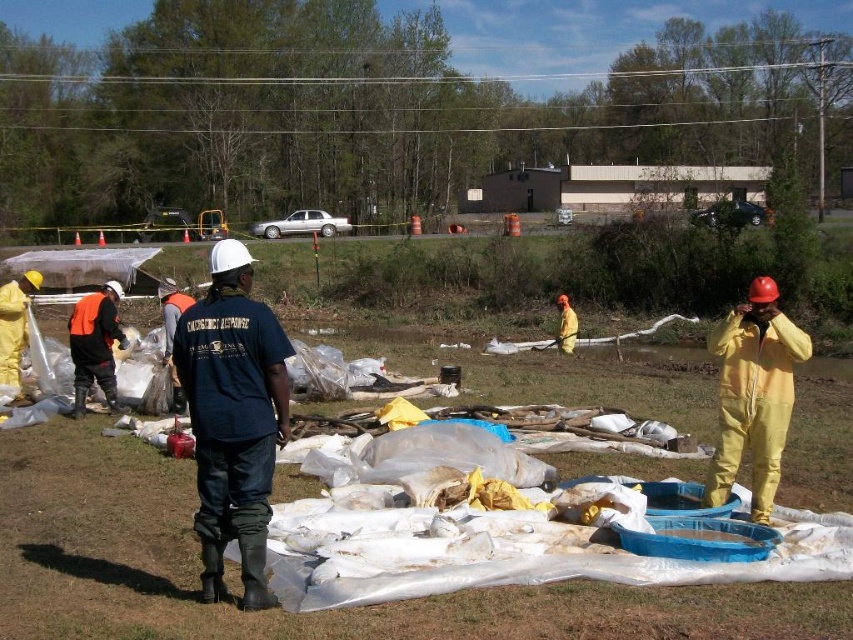
You are standing at the point marked as point [363,348] in the scene. You need to move to the nearest emergency exit, which is located 20 meters away from your current position. Is the emergency exit within your reach without moving further than 20 meters?

The distance between point [363,348] and the viewer is 21.92 meters. Since the emergency exit is 20 meters away from your current position, the exit is beyond the 20 meter limit, so you cannot reach it without moving further.

You are a safety inspector evaluating the scene. You notice the yellow rubber boots at center and the yellow matte suit at right. Which object is positioned closer to your current vantage point?

The yellow rubber boots at center is closer to the viewer than the yellow matte suit at right.